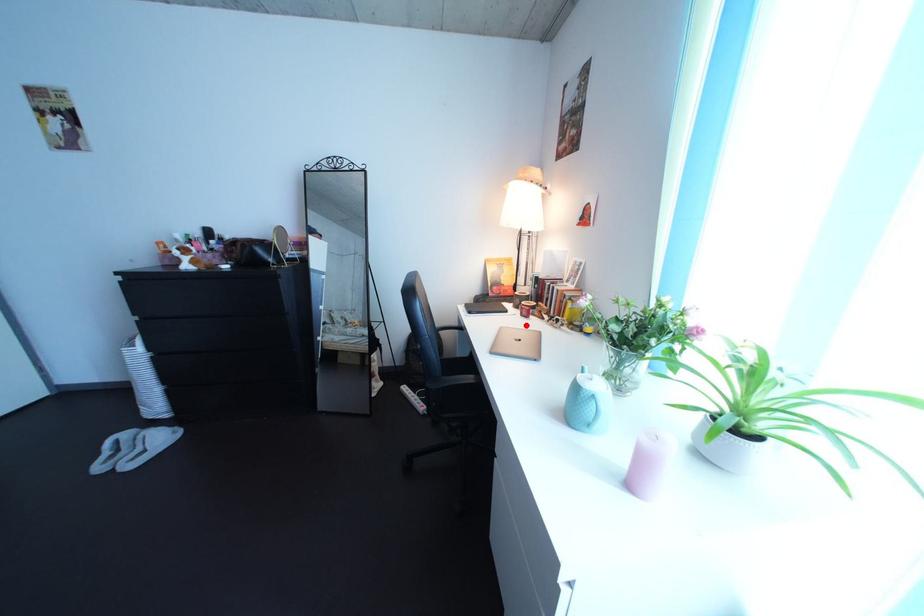
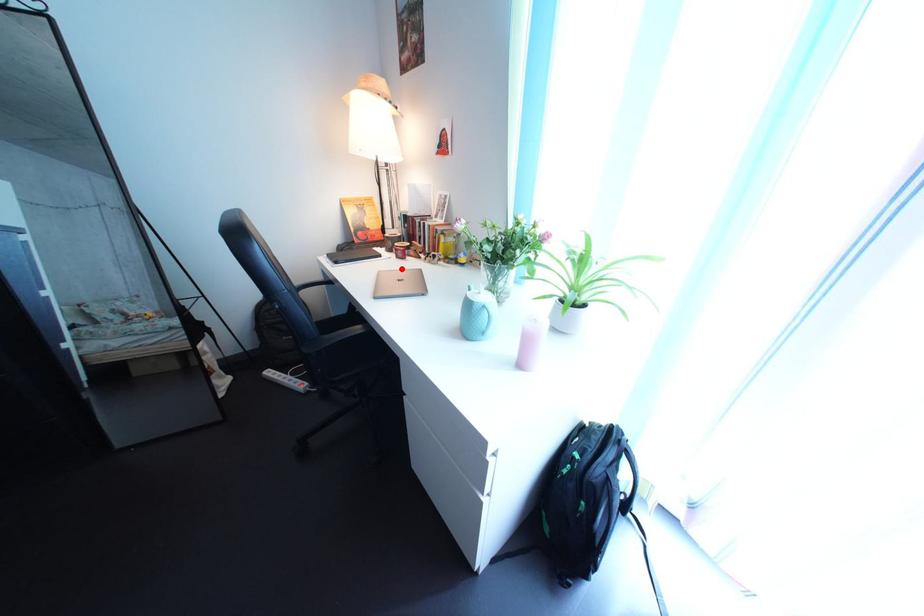
I am providing you with two images of the same scene from different viewpoints. A red point is marked on the first image and another point is marked on the second image. Do the highlighted points in image1 and image2 indicate the same real-world spot?

Yes